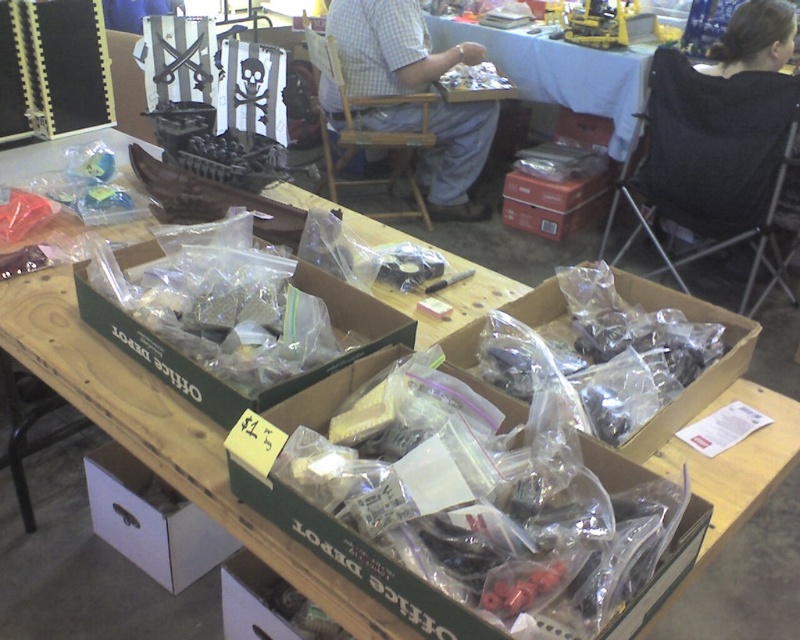
Question: Based on their relative distances, which object is farther from the red cardboard box at center?

Choices:
 (A) white cardboard box at lower left
 (B) clear plastic box at center
 (C) checkered fabric shirt at center

Answer: (B)

Question: Can you confirm if checkered fabric shirt at center is smaller than red cardboard box at center?

Choices:
 (A) no
 (B) yes

Answer: (A)

Question: Which of the following is the closest to the observer?

Choices:
 (A) (384, 330)
 (B) (110, 449)
 (C) (596, 216)

Answer: (A)

Question: Among these points, which one is farthest from the camera?

Choices:
 (A) (450, 337)
 (B) (393, 342)
 (C) (516, 198)
 (D) (106, 516)

Answer: (C)

Question: Is clear plastic box at center further to the viewer compared to translucent plastic parts at center?

Choices:
 (A) yes
 (B) no

Answer: (A)

Question: Does translucent plastic parts at center appear over white crumpled paper at center?

Choices:
 (A) no
 (B) yes

Answer: (A)